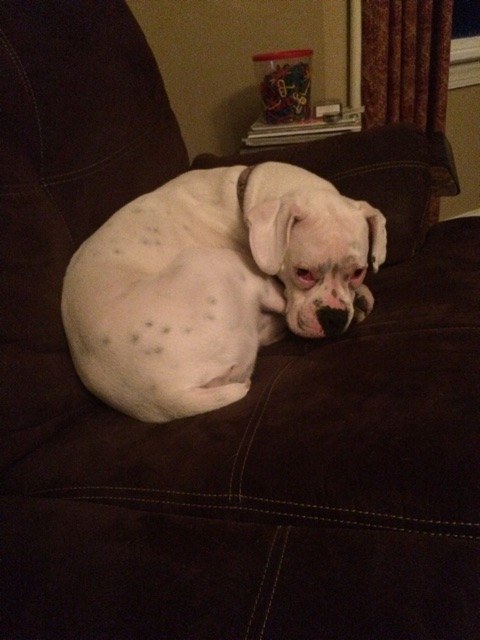
You are a GUI agent. You are given a task and a screenshot of the screen. Output one action in this format:
    pyautogui.click(x=<x>, y=<y>)
    Task: Click on the window curtain
    The image size is (480, 640).
    Given the screenshot: What is the action you would take?
    pyautogui.click(x=404, y=80)